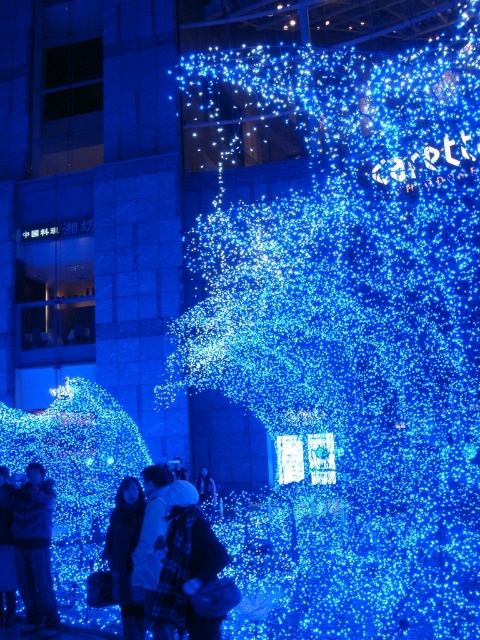
You are a photographer standing in front of the festive structure with blue lights. You notice a white woolen hat at lower left and a white matte jacket at center. Which object is located more to the left?

The white woolen hat at lower left is more to the left than the white matte jacket at center.

You are standing in the festive scene with the large illuminated structure. You need to place a gift under the matte black jacket at lower left. Where exactly should you place the gift relative to the jacket?

The gift should be placed at the location of the matte black jacket at lower left since it is located at point (34,545).